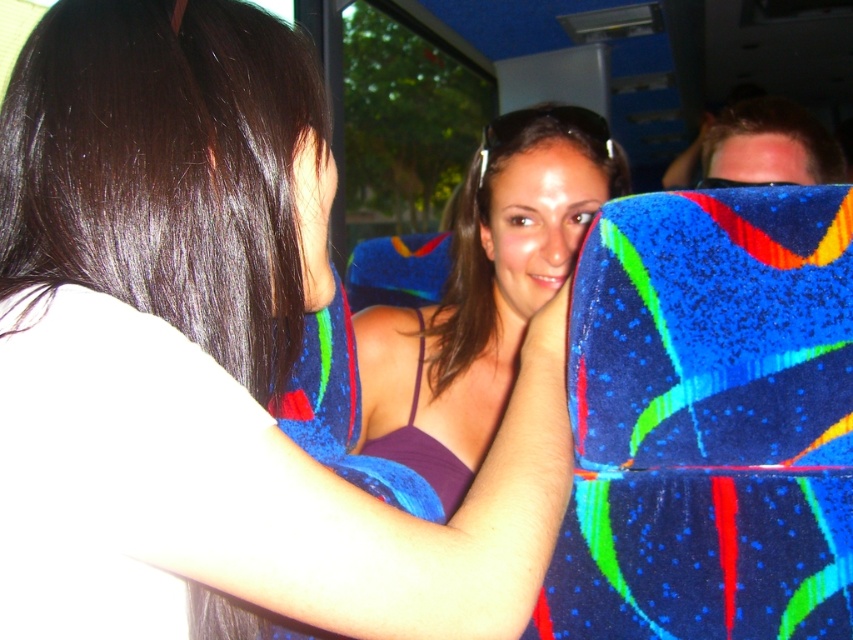
Question: Is blue textured fabric at right bigger than matte purple tank top at center?

Choices:
 (A) no
 (B) yes

Answer: (A)

Question: Can you confirm if blue textured fabric at right is thinner than shiny dark brown hair at upper left?

Choices:
 (A) no
 (B) yes

Answer: (A)

Question: Based on their relative distances, which object is nearer to the purple fabric at center?

Choices:
 (A) blue textured fabric at right
 (B) matte purple tank top at center

Answer: (A)

Question: Among these points, which one is nearest to the camera?

Choices:
 (A) (714, 513)
 (B) (364, 388)

Answer: (A)

Question: Does purple fabric at center come in front of matte purple tank top at center?

Choices:
 (A) no
 (B) yes

Answer: (B)

Question: Which of the following is the closest to the observer?

Choices:
 (A) (569, 326)
 (B) (509, 228)

Answer: (A)